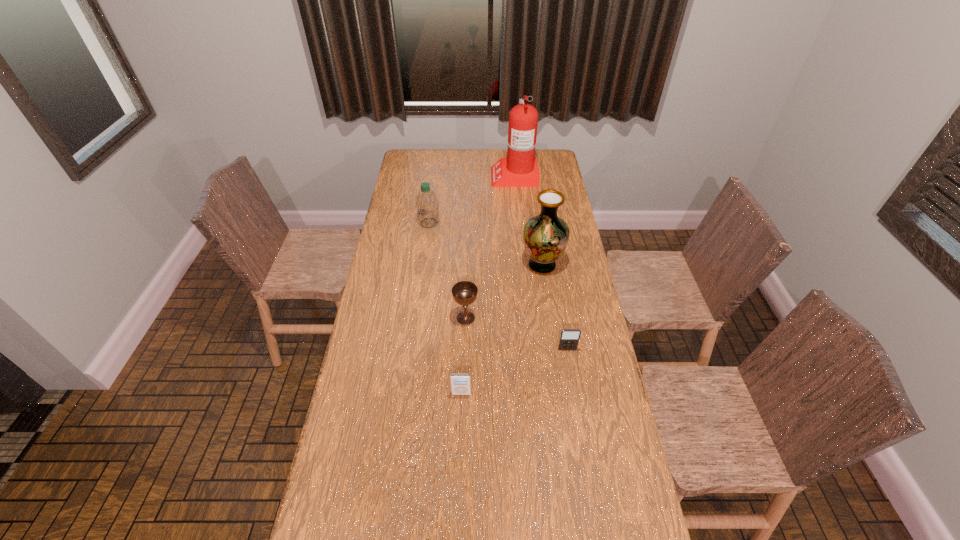
You are a GUI agent. You are given a task and a screenshot of the screen. Output one action in this format:
    pyautogui.click(x=<x>, y=<y>)
    Task: Click on the free space that is in between the left iPod and the tallest object
    The height and width of the screenshot is (540, 960).
    Given the screenshot: What is the action you would take?
    pyautogui.click(x=488, y=285)

Where is `unoccupied area between the farthest object and the left iPod`? The image size is (960, 540). unoccupied area between the farthest object and the left iPod is located at coordinates (488, 285).

Find the location of a particular element. The image size is (960, 540). vacant area between the farthest object and the chalice is located at coordinates (490, 247).

This screenshot has width=960, height=540. What are the coordinates of `vacant space in between the vase and the left iPod` in the screenshot? It's located at (501, 329).

Image resolution: width=960 pixels, height=540 pixels. Find the location of `free space that is in between the fifth farthest object and the left iPod`. free space that is in between the fifth farthest object and the left iPod is located at coordinates (515, 372).

Identify the location of free space that is in between the chalice and the nearer iPod. The image size is (960, 540). (464, 356).

I want to click on vacant point located between the farther iPod and the vase, so click(555, 307).

Find the location of a particular element. This screenshot has width=960, height=540. free space that is in between the nearest object and the fifth shortest object is located at coordinates (501, 329).

Image resolution: width=960 pixels, height=540 pixels. I want to click on unoccupied position between the third nearest object and the farther iPod, so click(516, 334).

At what (x,y) coordinates should I click in order to perform the action: click on object that can be found as the third closest to the nearest object. Please return your answer as a coordinate pair (x, y). This screenshot has width=960, height=540. Looking at the image, I should click on (545, 236).